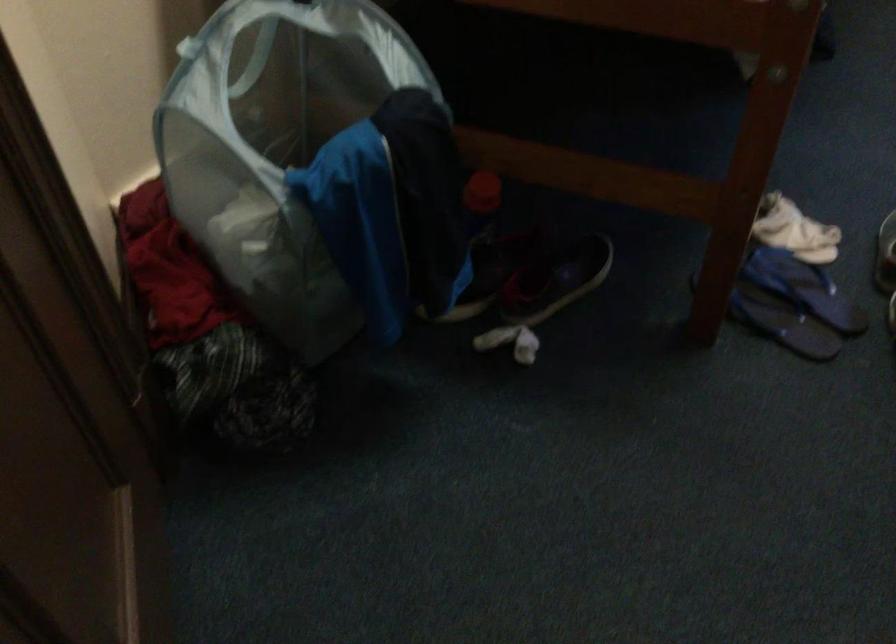
The width and height of the screenshot is (896, 644). In order to click on laundry basket handle in this screenshot , I will do `click(186, 46)`.